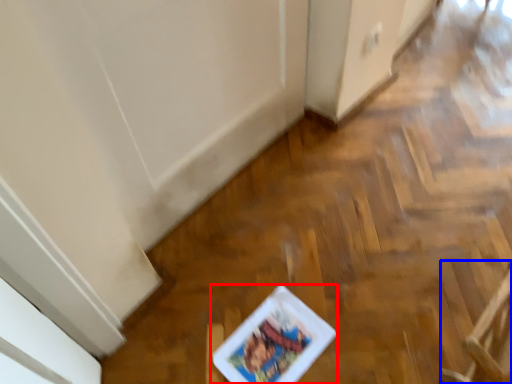
Question: Which of the following is the farthest to the observer, comic book (highlighted by a red box) or armchair (highlighted by a blue box)?

Choices:
 (A) comic book
 (B) armchair

Answer: (A)